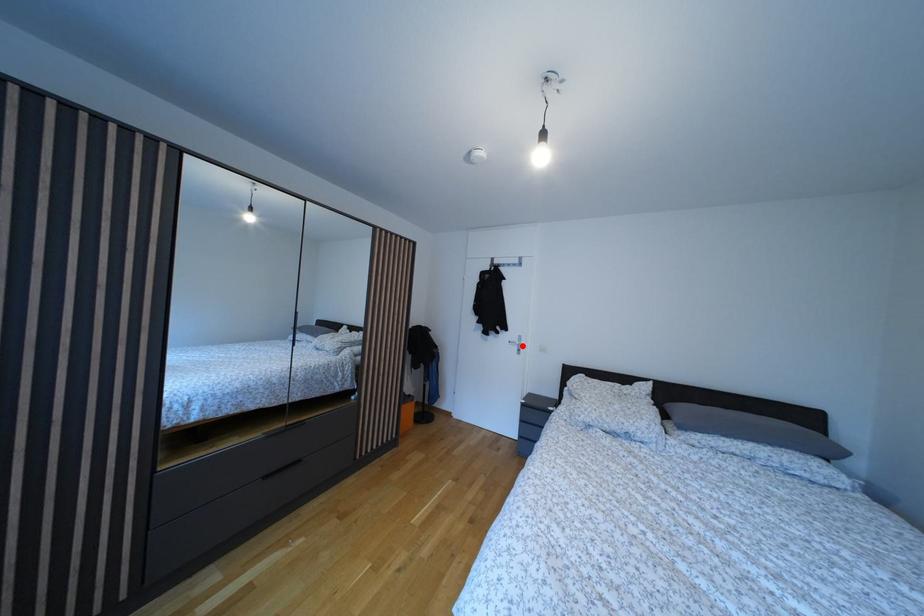
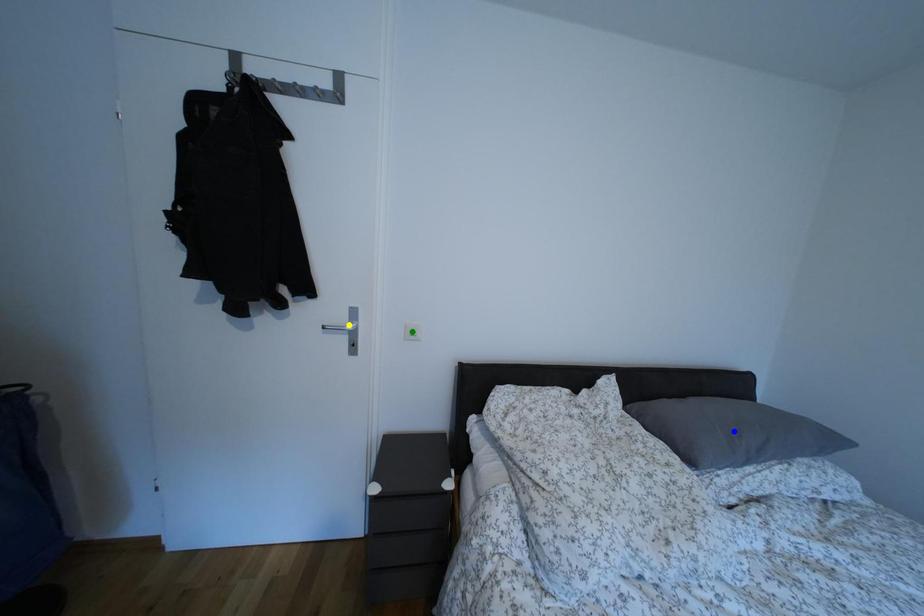
Question: I am providing you with two images of the same scene from different viewpoints. A red point is marked on the first image. You are given multiple points on the second image. Can you choose the point in image 2 that corresponds to the point in image 1?

Choices:
 (A) green point
 (B) blue point
 (C) yellow point

Answer: (C)